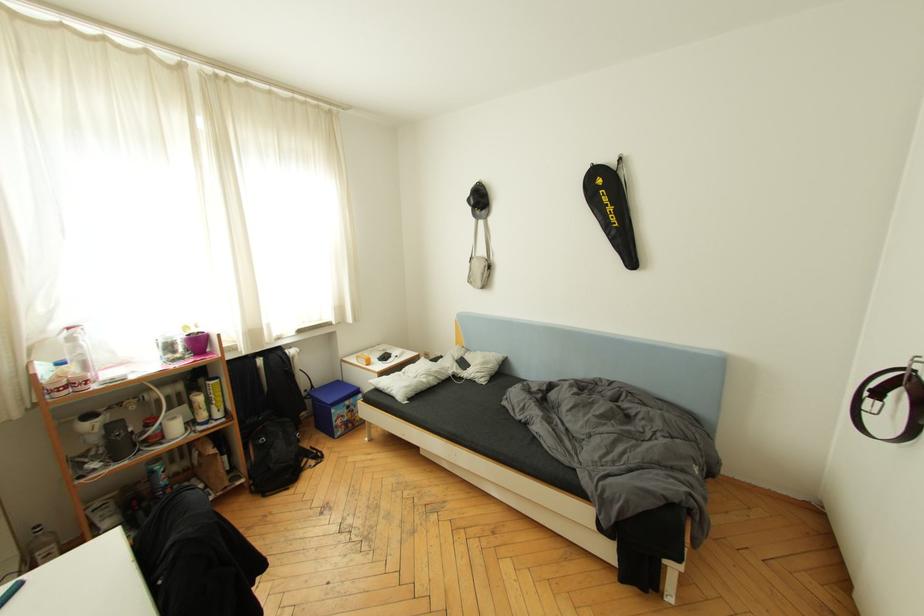
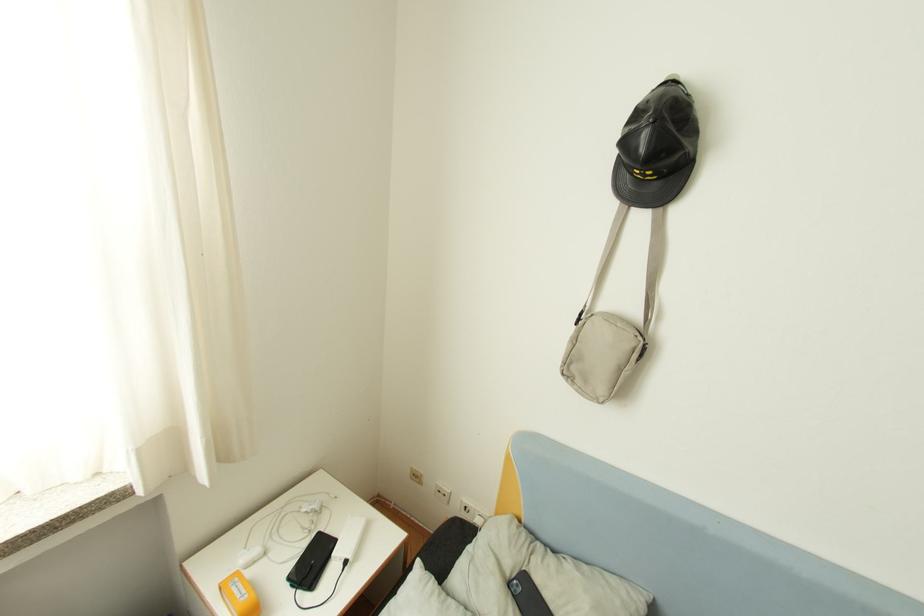
Question: Which direction would the cameraman need to move to produce the second image? Reply with the corresponding letter.

Choices:
 (A) Left
 (B) Right
 (C) Forward
 (D) Backward

Answer: (C)